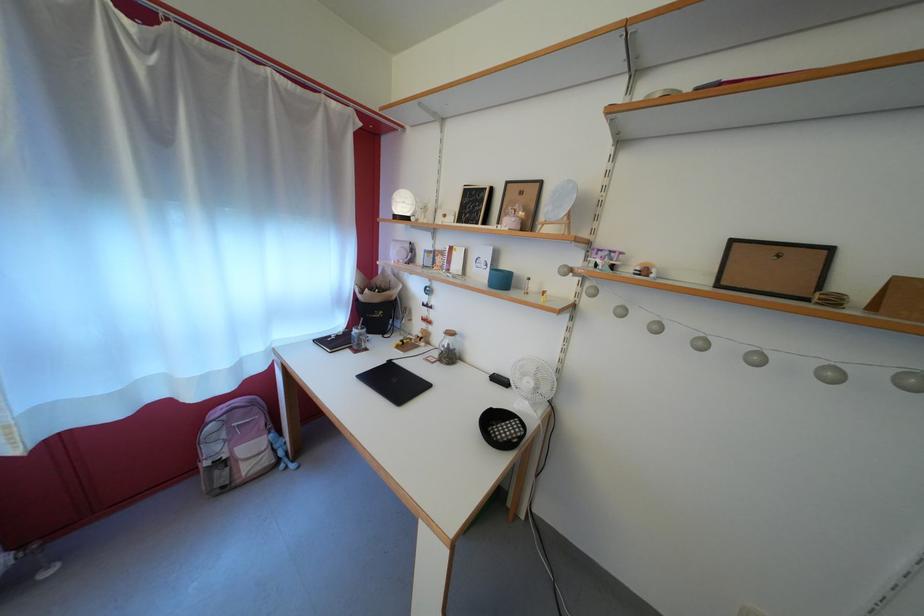
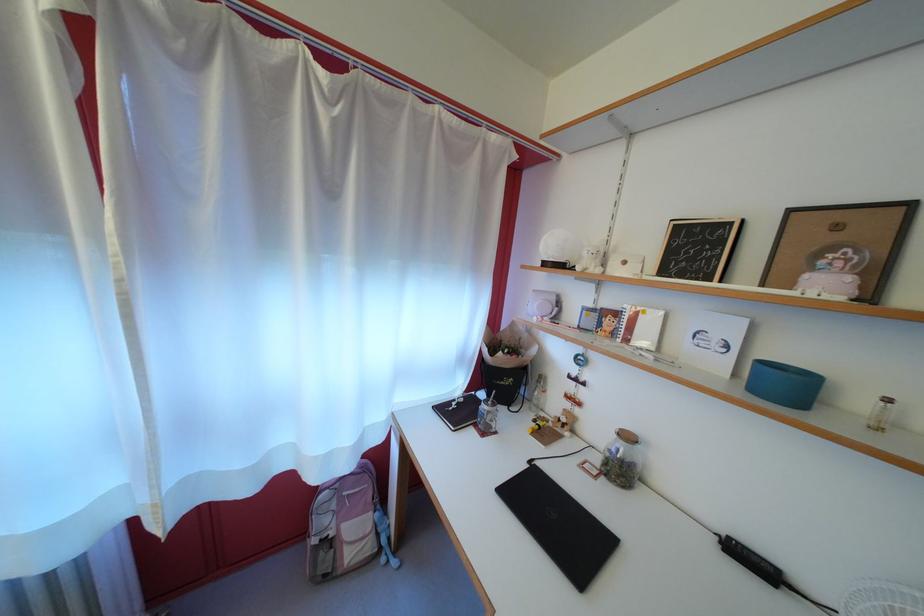
Where in the second image is the point corresponding to [459,339] from the first image?

(637, 444)